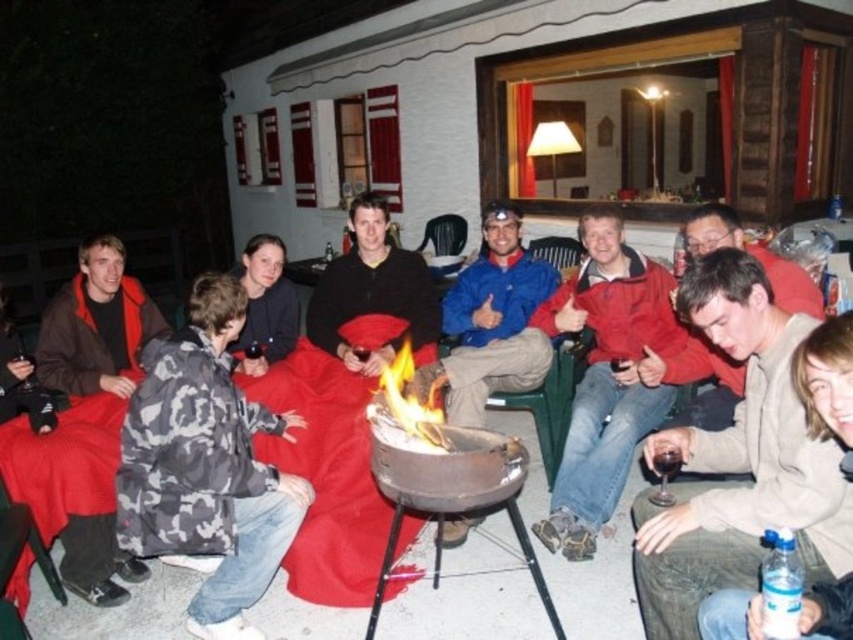
Is point (631, 397) closer to viewer compared to point (369, 204)?

Yes, it is in front of point (369, 204).

What are the coordinates of `red matte jacket at center` in the screenshot? It's located at (605, 378).

Locate an element on the screen. Image resolution: width=853 pixels, height=640 pixels. red matte jacket at center is located at coordinates (605, 378).

At what (x,y) coordinates should I click in order to perform the action: click on light brown leather jacket at lower right. Please return your answer as a coordinate pair (x, y). The width and height of the screenshot is (853, 640). Looking at the image, I should click on (738, 461).

Which is in front, point (722, 492) or point (589, 385)?

Positioned in front is point (722, 492).

Identify the location of light brown leather jacket at lower right. (738, 461).

Find the location of a particular element. The image size is (853, 640). light brown leather jacket at lower right is located at coordinates (738, 461).

Who is lower down, light brown leather jacket at lower right or brown fleece jacket at left?

Positioned lower is light brown leather jacket at lower right.

Is light brown leather jacket at lower right smaller than brown fleece jacket at left?

No.

Does point (813, 525) lie in front of point (49, 323)?

That is True.

Identify the location of light brown leather jacket at lower right. (738, 461).